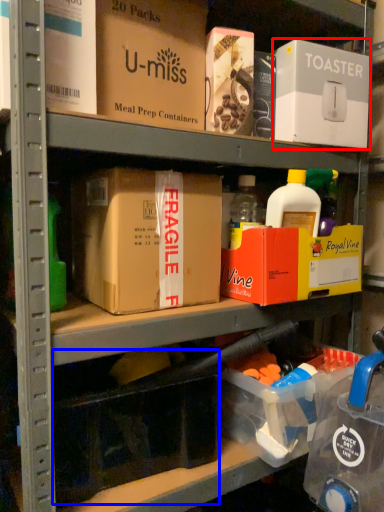
Question: Which object is further to the camera taking this photo, box (highlighted by a red box) or storage box (highlighted by a blue box)?

Choices:
 (A) box
 (B) storage box

Answer: (A)